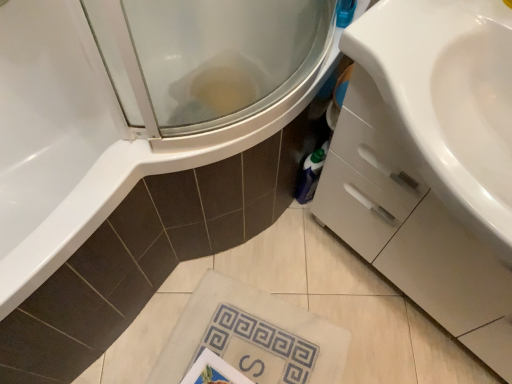
Question: Can you confirm if white glossy cabinet at right is smaller than white textured towel at lower center?

Choices:
 (A) no
 (B) yes

Answer: (A)

Question: From a real-world perspective, is white glossy cabinet at right physically below white textured towel at lower center?

Choices:
 (A) no
 (B) yes

Answer: (A)

Question: Is white glossy cabinet at right not close to white textured towel at lower center?

Choices:
 (A) no
 (B) yes

Answer: (A)

Question: Does white glossy cabinet at right have a greater height compared to white textured towel at lower center?

Choices:
 (A) yes
 (B) no

Answer: (A)

Question: Is white glossy cabinet at right facing towards white textured towel at lower center?

Choices:
 (A) no
 (B) yes

Answer: (B)

Question: Can you confirm if white glossy cabinet at right is shorter than white textured towel at lower center?

Choices:
 (A) yes
 (B) no

Answer: (B)

Question: From the image's perspective, would you say white textured towel at lower center is shown under white glossy cabinet at right?

Choices:
 (A) no
 (B) yes

Answer: (B)

Question: From a real-world perspective, does white textured towel at lower center sit lower than white glossy cabinet at right?

Choices:
 (A) no
 (B) yes

Answer: (B)

Question: Does white textured towel at lower center have a lesser width compared to white glossy cabinet at right?

Choices:
 (A) no
 (B) yes

Answer: (A)

Question: Is white textured towel at lower center to the right of white glossy cabinet at right from the viewer's perspective?

Choices:
 (A) no
 (B) yes

Answer: (A)

Question: Does white textured towel at lower center have a larger size compared to white glossy cabinet at right?

Choices:
 (A) yes
 (B) no

Answer: (B)

Question: Does white textured towel at lower center contain white glossy cabinet at right?

Choices:
 (A) yes
 (B) no

Answer: (B)

Question: From the image's perspective, is white glossy cabinet at right above or below white textured towel at lower center?

Choices:
 (A) below
 (B) above

Answer: (B)